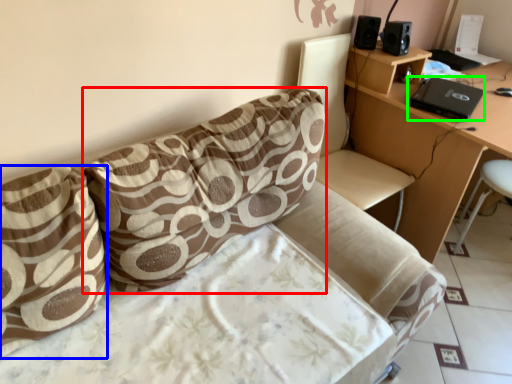
Question: Which object is the closest to the pillow (highlighted by a red box)? Choose among these: pillow (highlighted by a blue box) or laptop (highlighted by a green box).

Choices:
 (A) pillow
 (B) laptop

Answer: (A)